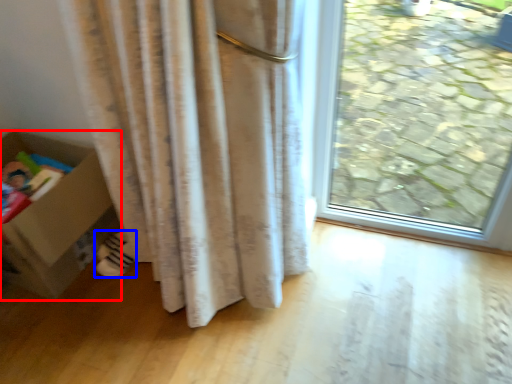
Question: Which object appears closest to the camera in this image, box (highlighted by a red box) or footwear (highlighted by a blue box)?

Choices:
 (A) box
 (B) footwear

Answer: (A)